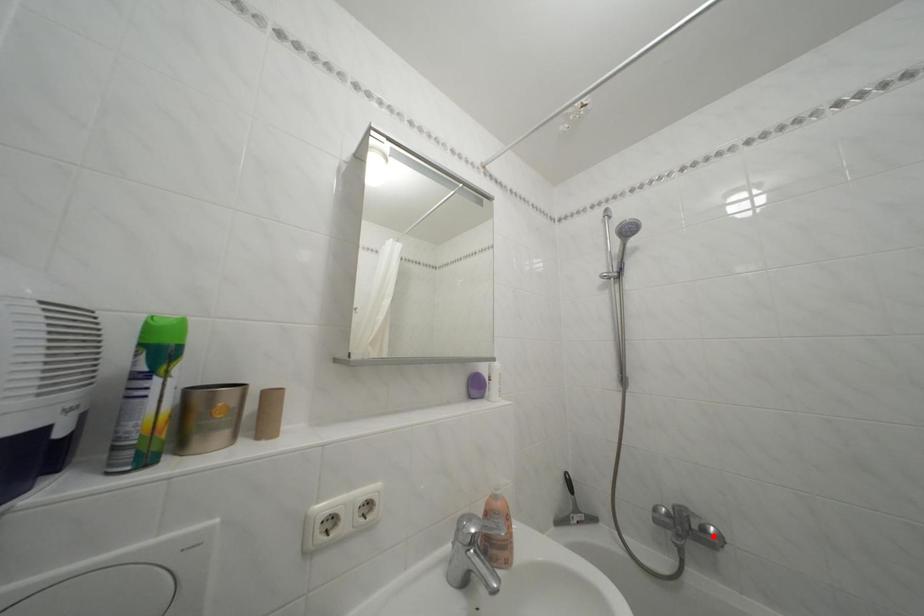
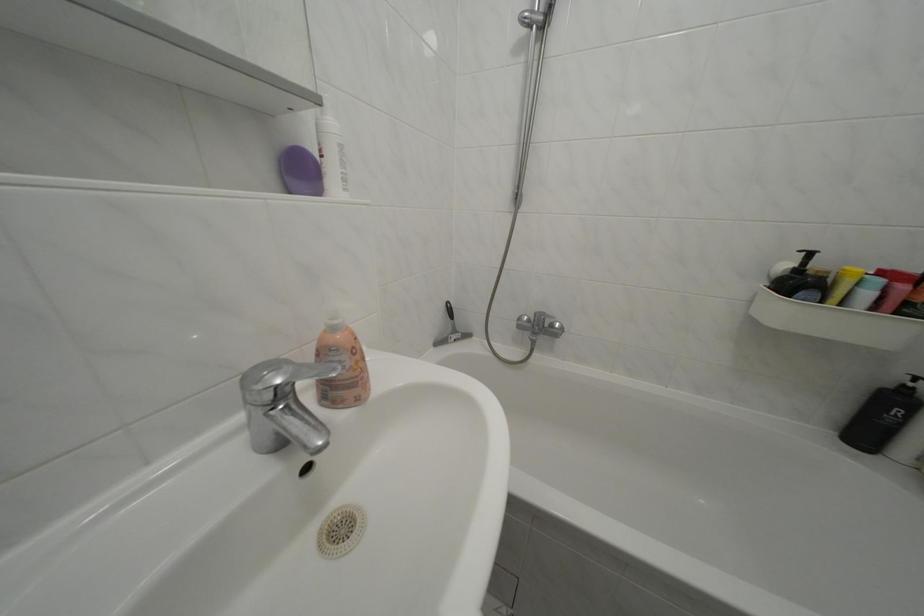
The point at the highlighted location is marked in the first image. Where is the corresponding point in the second image?

(562, 331)